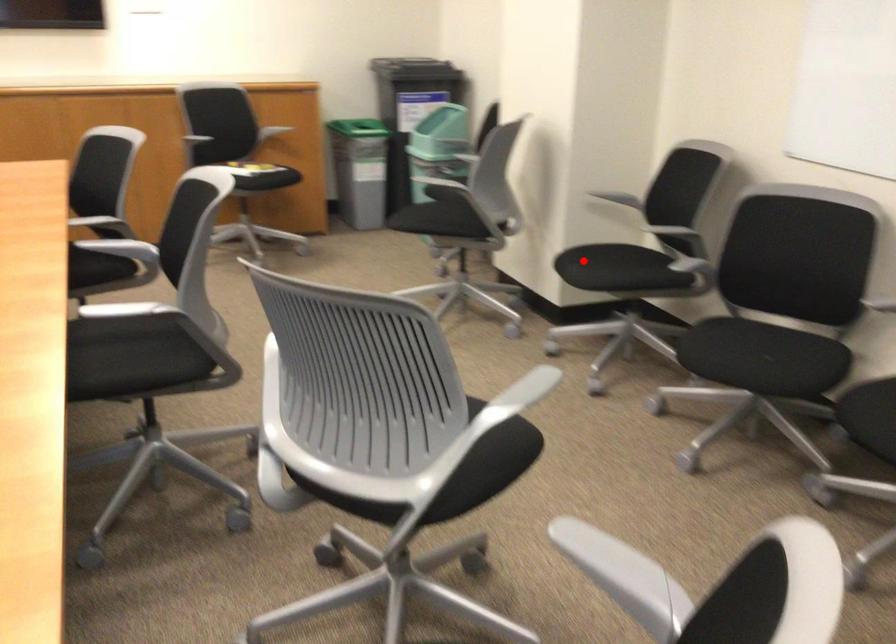
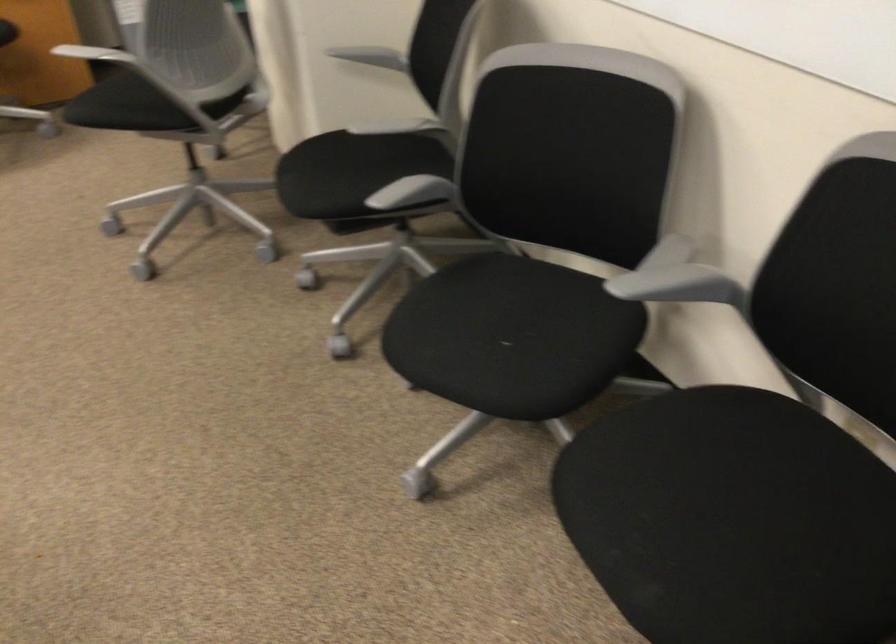
Locate, in the second image, the point that corresponds to the highlighted location in the first image.

(319, 176)